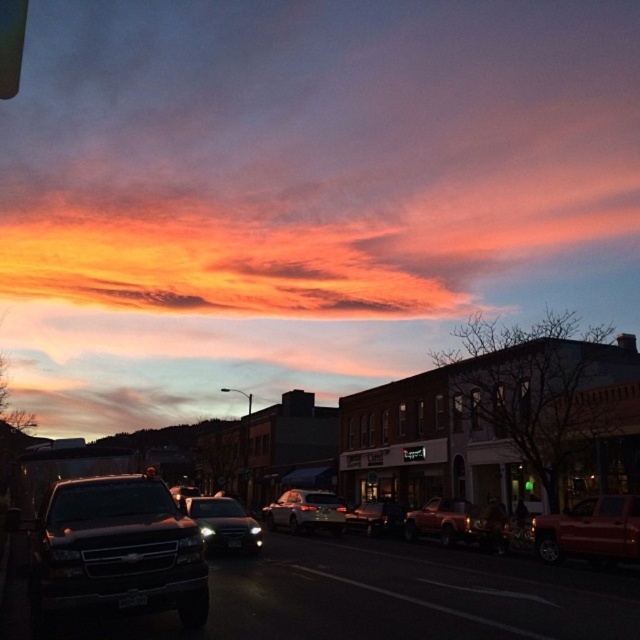
What do you see at coordinates (456, 522) in the screenshot? I see `matte orange truck at center` at bounding box center [456, 522].

Which is more to the left, matte orange truck at center or satin black sedan at center?

Positioned to the left is satin black sedan at center.

Is point (440, 522) closer to viewer compared to point (211, 531)?

That is False.

You are a GUI agent. You are given a task and a screenshot of the screen. Output one action in this format:
    pyautogui.click(x=<x>, y=<y>)
    Task: Click on the matte orange truck at center
    
    Given the screenshot: What is the action you would take?
    pyautogui.click(x=456, y=522)

Based on the photo, does shiny black truck at lower left have a greater width compared to satin silver sedan at center?

No, shiny black truck at lower left is not wider than satin silver sedan at center.

Who is shorter, shiny black truck at lower left or satin silver sedan at center?

With less height is shiny black truck at lower left.

Which is behind, point (74, 548) or point (307, 500)?

The point (307, 500) is more distant.

Locate an element on the screen. This screenshot has height=640, width=640. shiny black truck at lower left is located at coordinates (115, 552).

Can you confirm if matte orange sky at upper center is taller than shiny black truck at lower left?

Yes, matte orange sky at upper center is taller than shiny black truck at lower left.

What do you see at coordinates (301, 193) in the screenshot?
I see `matte orange sky at upper center` at bounding box center [301, 193].

Find the location of a particular element. matte orange sky at upper center is located at coordinates (301, 193).